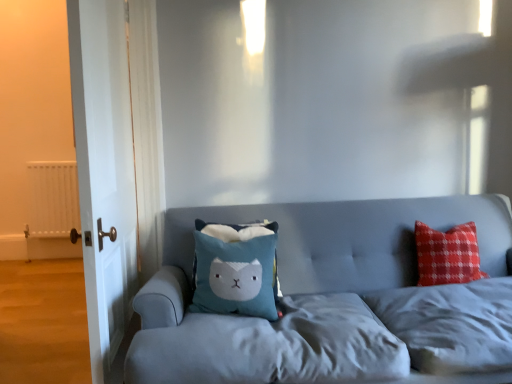
Question: Is white matte radiator at left spatially inside blue plush pillow at center, or outside of it?

Choices:
 (A) inside
 (B) outside

Answer: (B)

Question: Considering their positions, is white matte radiator at left located in front of or behind blue plush pillow at center?

Choices:
 (A) behind
 (B) front

Answer: (A)

Question: Which object is the closest to the velvet blue couch at center?

Choices:
 (A) white matte radiator at left
 (B) blue plush pillow at center
 (C) white wood door at left

Answer: (B)

Question: Estimate the real-world distances between objects in this image. Which object is closer to the white wood door at left?

Choices:
 (A) blue plush pillow at center
 (B) white matte radiator at left
 (C) velvet blue couch at center

Answer: (A)